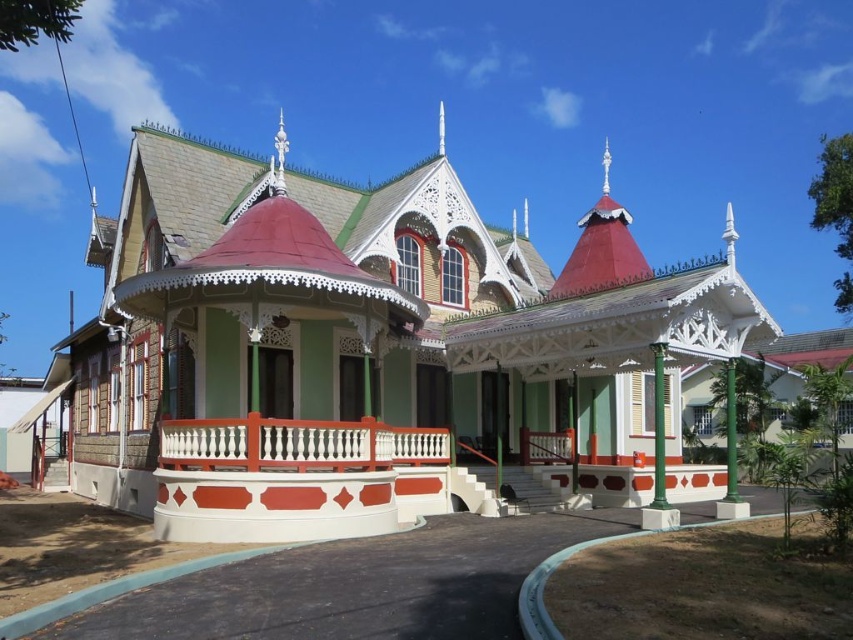
You are standing in front of the ornate Victorian building. You need to locate the white painted wood railing at center. Based on the coordinates provided, can you tell me in which direction from the building entrance the railing is positioned?

The white painted wood railing at center is located at coordinates point (297, 444), which is to the right side of the building entrance.